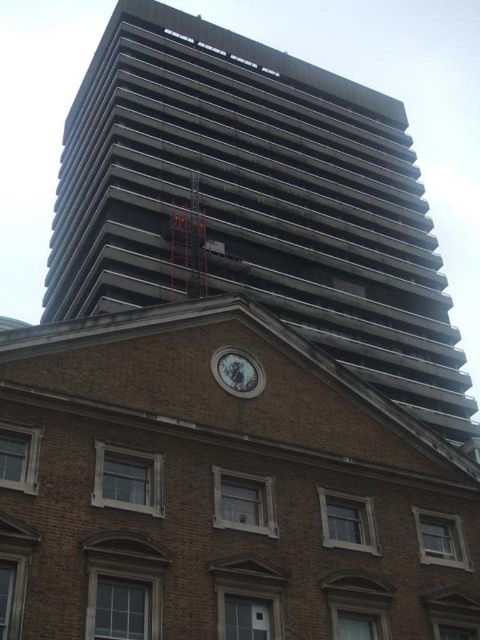
Is the position of dark gray concrete building at upper center more distant than that of white glossy clock at center?

Yes, it is.

Between dark gray concrete building at upper center and white glossy clock at center, which one appears on the right side from the viewer's perspective?

Positioned to the right is white glossy clock at center.

Between point (408, 256) and point (217, 362), which one is positioned behind?

The point (408, 256) is more distant.

Where is `dark gray concrete building at upper center`? dark gray concrete building at upper center is located at coordinates click(x=255, y=202).